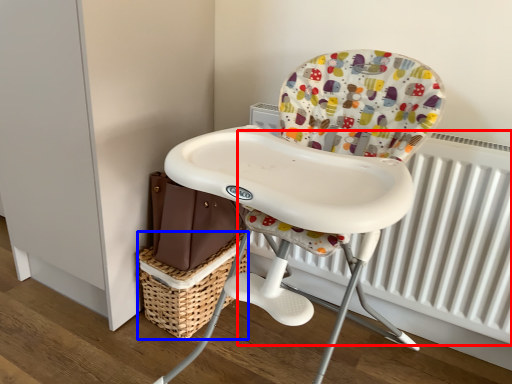
Question: Among these objects, which one is nearest to the camera, radiator (highlighted by a red box) or basket (highlighted by a blue box)?

Choices:
 (A) radiator
 (B) basket

Answer: (A)